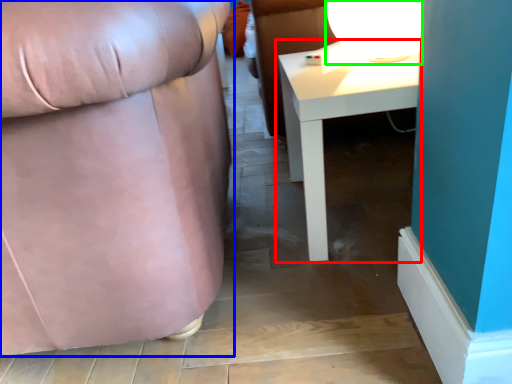
Question: Which object is the farthest from table (highlighted by a red box)? Choose among these: chair (highlighted by a blue box) or table lamp (highlighted by a green box).

Choices:
 (A) chair
 (B) table lamp

Answer: (A)